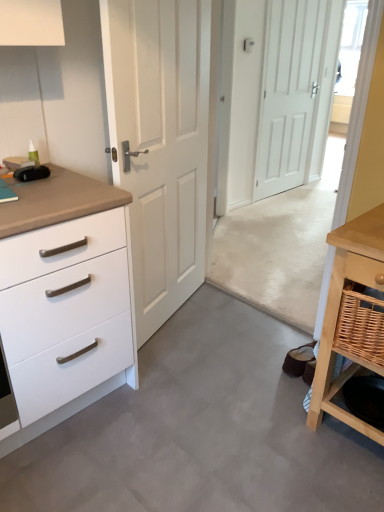
Where is `vacant area that lies to the right of white matte door at center, the first door viewed from the right`? The width and height of the screenshot is (384, 512). vacant area that lies to the right of white matte door at center, the first door viewed from the right is located at coordinates (315, 188).